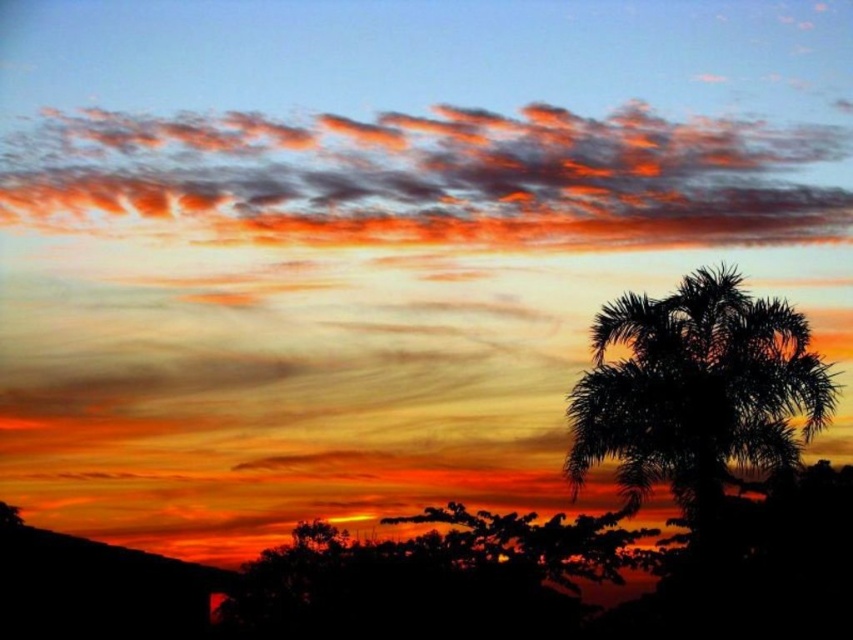
You are an artist painting the sunset scene. You want to paint the glowing orange clouds at upper center and the silhouette palm tree at right. Which object should you paint first to follow the proper layering technique?

You should paint the glowing orange clouds at upper center first because they are closer to the viewer than the silhouette palm tree at right, so they should be layered on top.

You are an astronomer analyzing the sunset scene. You notice a specific point in the image at coordinates point (x=424, y=179). What is the object located at that point?

The object at point (x=424, y=179) is glowing orange clouds at upper center.

You are an astronomer observing the sunset and notice the glowing orange clouds at upper center and the silhouette palm tree at right. Which object is located to the left of the other?

The glowing orange clouds at upper center are positioned to the left of the silhouette palm tree at right.